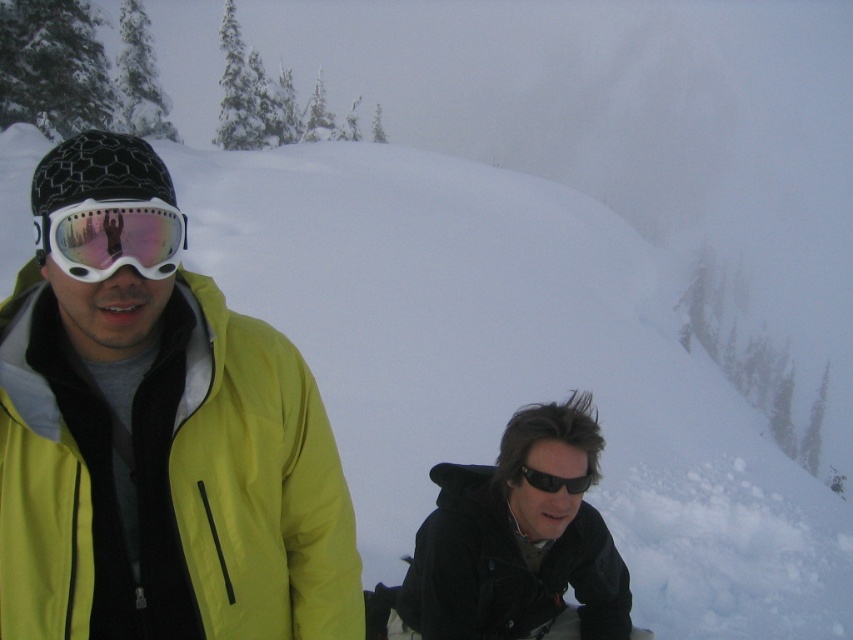
How much distance is there between matte white goggles at left and black reflective sunglasses at lower center?

They are 6.96 feet apart.

Who is more distant from viewer, [115,237] or [556,490]?

Positioned behind is point [556,490].

What do you see at coordinates (112, 237) in the screenshot?
I see `matte white goggles at left` at bounding box center [112, 237].

Identify the location of matte white goggles at left. (112, 237).

The height and width of the screenshot is (640, 853). Describe the element at coordinates (508, 570) in the screenshot. I see `black matte jacket at lower right` at that location.

Is black matte jacket at lower right below black reflective sunglasses at lower center?

Indeed, black matte jacket at lower right is positioned under black reflective sunglasses at lower center.

What do you see at coordinates (508, 570) in the screenshot? The width and height of the screenshot is (853, 640). I see `black matte jacket at lower right` at bounding box center [508, 570].

You are a GUI agent. You are given a task and a screenshot of the screen. Output one action in this format:
    pyautogui.click(x=<x>, y=<y>)
    Task: Click on the black matte jacket at lower right
    Image resolution: width=853 pixels, height=640 pixels.
    Given the screenshot: What is the action you would take?
    pyautogui.click(x=508, y=570)

Is black matte jacket at lower right below matte white goggles at left?

Indeed, black matte jacket at lower right is positioned under matte white goggles at left.

Can you confirm if black matte jacket at lower right is bigger than matte white goggles at left?

Indeed, black matte jacket at lower right has a larger size compared to matte white goggles at left.

Is point (445, 480) farther from viewer compared to point (45, 243)?

That is True.

Find the location of a particular element. black matte jacket at lower right is located at coordinates (508, 570).